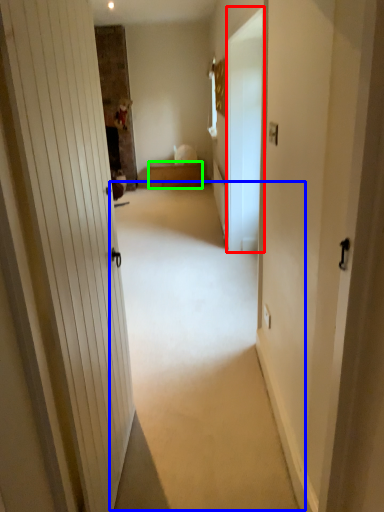
Question: Estimate the real-world distances between objects in this image. Which object is closer to screen door (highlighted by a red box), plain (highlighted by a blue box) or furniture (highlighted by a green box)?

Choices:
 (A) plain
 (B) furniture

Answer: (A)